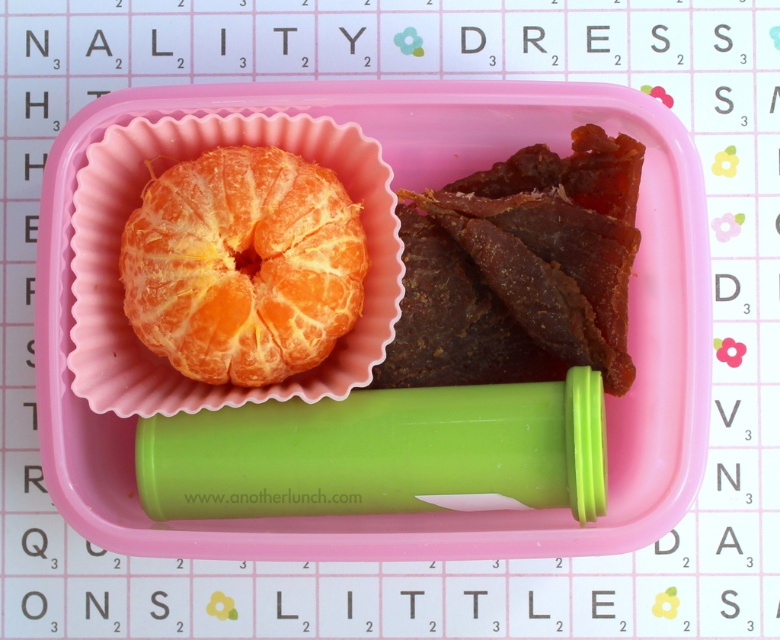
Question: From the image, what is the correct spatial relationship of brown/crumbly jerky at right in relation to orangejuicy fleshorange segment at left?

Choices:
 (A) above
 (B) below

Answer: (B)

Question: Which point appears farthest from the camera in this image?

Choices:
 (A) (240, 257)
 (B) (451, 184)

Answer: (B)

Question: Does brown/crumbly jerky at right appear over orangejuicy fleshorange segment at left?

Choices:
 (A) no
 (B) yes

Answer: (A)

Question: Considering the relative positions of brown/crumbly jerky at right and orangejuicy fleshorange segment at left in the image provided, where is brown/crumbly jerky at right located with respect to orangejuicy fleshorange segment at left?

Choices:
 (A) left
 (B) right

Answer: (B)